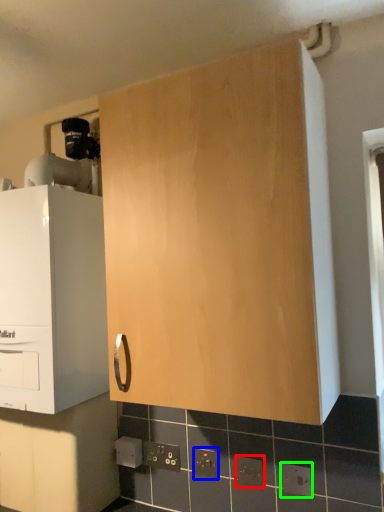
Question: Considering the real-world distances, which object is closest to electric outlet (highlighted by a red box)? electric outlet (highlighted by a blue box) or electric outlet (highlighted by a green box).

Choices:
 (A) electric outlet
 (B) electric outlet

Answer: (B)